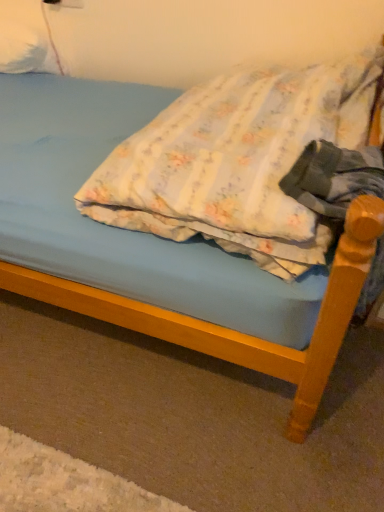
Question: From the image's perspective, is white fluffy pillow at upper left, which is the 1th pillow in left-to-right order, located above or below floral fabric pillow at center, which is counted as the second pillow, starting from the top?

Choices:
 (A) above
 (B) below

Answer: (A)

Question: Is point (24, 50) positioned closer to the camera than point (198, 129)?

Choices:
 (A) farther
 (B) closer

Answer: (A)

Question: In the image, is white fluffy pillow at upper left, positioned as the second pillow in bottom-to-top order, positioned in front of or behind floral fabric pillow at center, which is counted as the second pillow, starting from the top?

Choices:
 (A) front
 (B) behind

Answer: (B)

Question: Based on their sizes in the image, would you say floral fabric pillow at center, which is the 1th pillow in right-to-left order, is bigger or smaller than white fluffy pillow at upper left, which appears as the 2th pillow when viewed from the front?

Choices:
 (A) big
 (B) small

Answer: (A)

Question: Considering the positions of point pyautogui.click(x=150, y=146) and point pyautogui.click(x=36, y=38), is point pyautogui.click(x=150, y=146) closer or farther from the camera than point pyautogui.click(x=36, y=38)?

Choices:
 (A) farther
 (B) closer

Answer: (B)

Question: Is floral fabric pillow at center, which is the 1th pillow in right-to-left order, in front of or behind white fluffy pillow at upper left, positioned as the second pillow in bottom-to-top order, in the image?

Choices:
 (A) behind
 (B) front

Answer: (B)

Question: Visually, is floral fabric pillow at center, acting as the second pillow starting from the back, positioned to the left or to the right of white fluffy pillow at upper left, which appears as the 2th pillow when viewed from the front?

Choices:
 (A) right
 (B) left

Answer: (A)